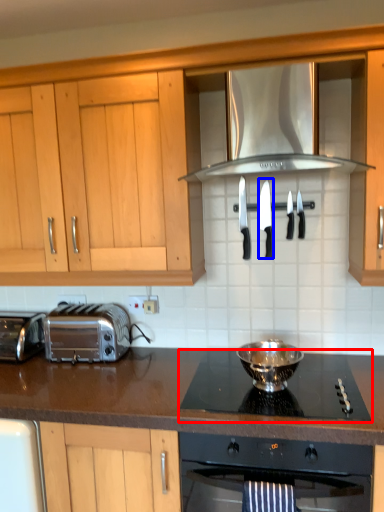
Question: Which object is closer to the camera taking this photo, gas stove (highlighted by a red box) or knife (highlighted by a blue box)?

Choices:
 (A) gas stove
 (B) knife

Answer: (A)